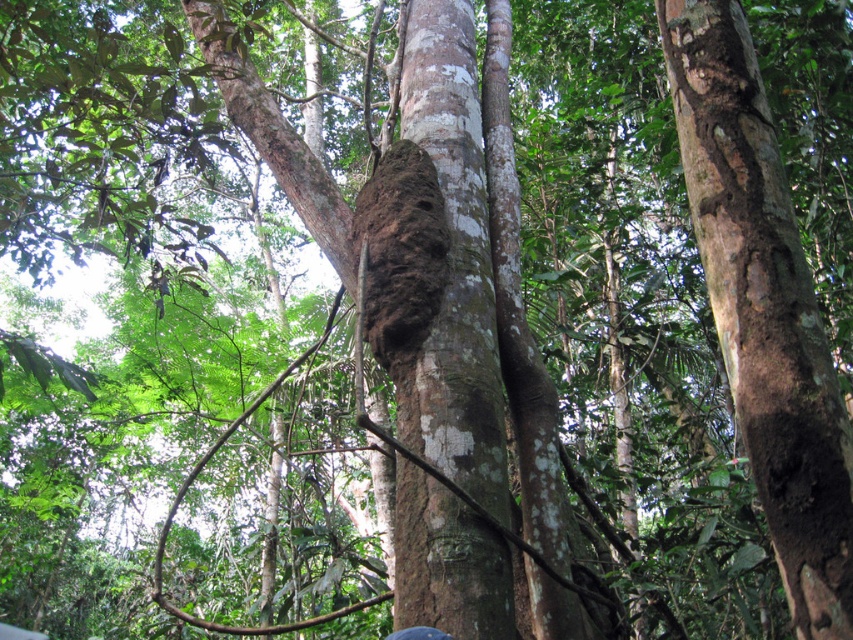
Question: Which object appears farthest from the camera in this image?

Choices:
 (A) brown rough bark tree trunk at center
 (B) brown rough bark at center

Answer: (A)

Question: Is brown rough bark at center wider than brown rough bark tree trunk at center?

Choices:
 (A) no
 (B) yes

Answer: (A)

Question: Is brown rough bark at center below brown rough bark tree trunk at center?

Choices:
 (A) yes
 (B) no

Answer: (A)

Question: Does brown rough bark at center have a smaller size compared to brown rough bark tree trunk at center?

Choices:
 (A) no
 (B) yes

Answer: (B)